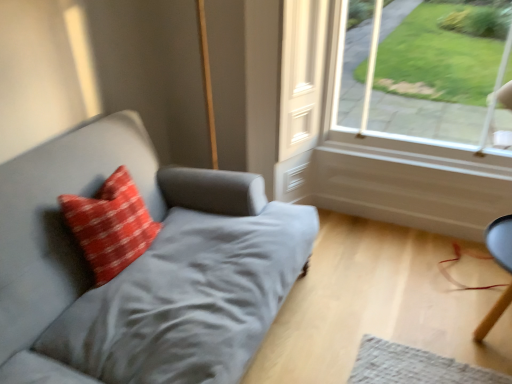
Find the location of a particular element. This screenshot has width=512, height=384. vacant region to the left of smooth black chair at lower right is located at coordinates (412, 324).